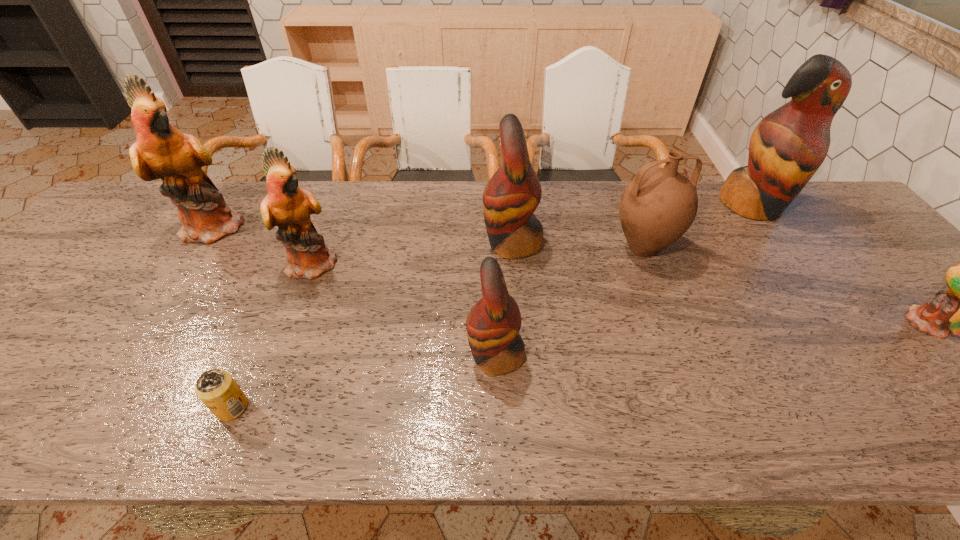
Locate an element on the screen. vacant space situated on the face of the nearest red parrot is located at coordinates (390, 356).

This screenshot has height=540, width=960. What are the coordinates of `vacant space positioned 0.150m on the face of the nearest red parrot` in the screenshot? It's located at (399, 356).

This screenshot has width=960, height=540. Identify the location of vacant area situated 0.110m on the back of the beer can. (257, 349).

This screenshot has width=960, height=540. I want to click on pitcher at the far edge, so click(657, 207).

I want to click on object that is positioned at the near edge, so click(x=217, y=389).

At what (x,y) coordinates should I click in order to perform the action: click on vacant space at the far edge of the desktop. Please return your answer as a coordinate pair (x, y). This screenshot has height=540, width=960. Looking at the image, I should click on (387, 199).

I want to click on free region at the near edge of the desktop, so click(x=67, y=408).

In the image, there is a desktop. At what (x,y) coordinates should I click in order to perform the action: click on free region at the left edge. Please return your answer as a coordinate pair (x, y). The height and width of the screenshot is (540, 960). Looking at the image, I should click on (86, 255).

This screenshot has width=960, height=540. I want to click on free location at the right edge, so click(955, 384).

Identify the location of vacant space at the far right corner. (821, 185).